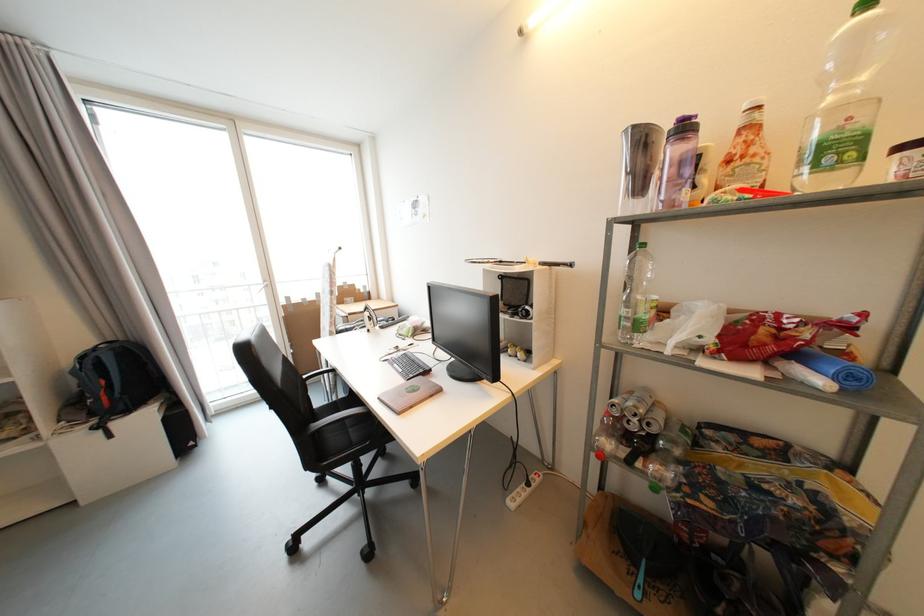
What do you see at coordinates (408, 394) in the screenshot?
I see `a pink book` at bounding box center [408, 394].